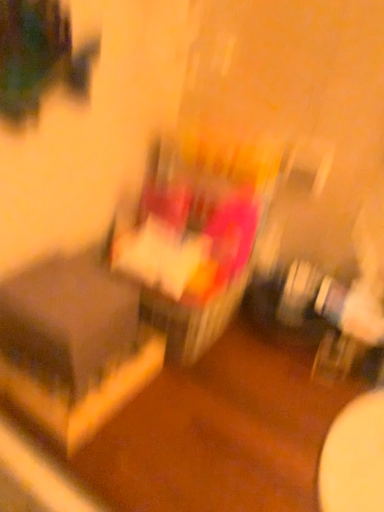
Question: Should I look upward or downward to see matte black table at left?

Choices:
 (A) down
 (B) up

Answer: (A)